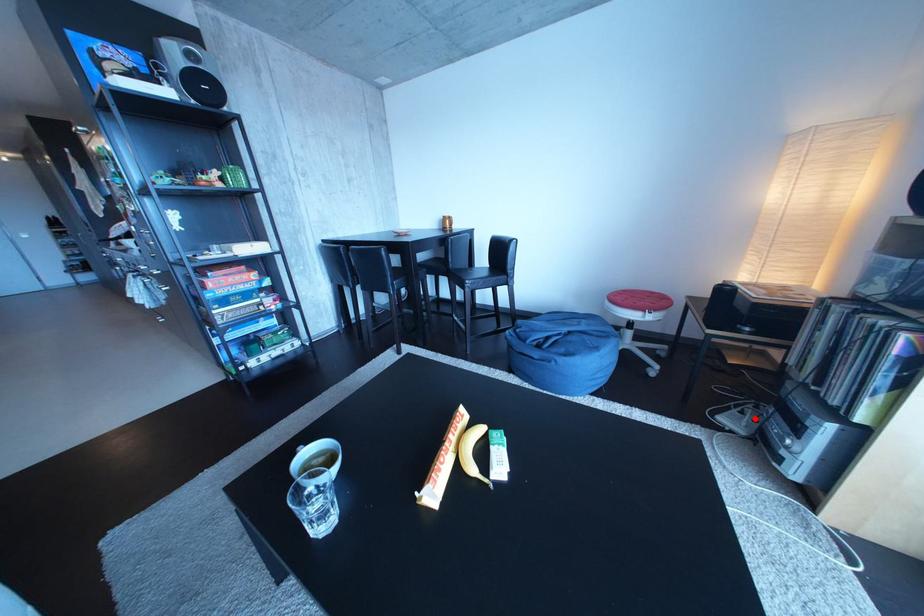
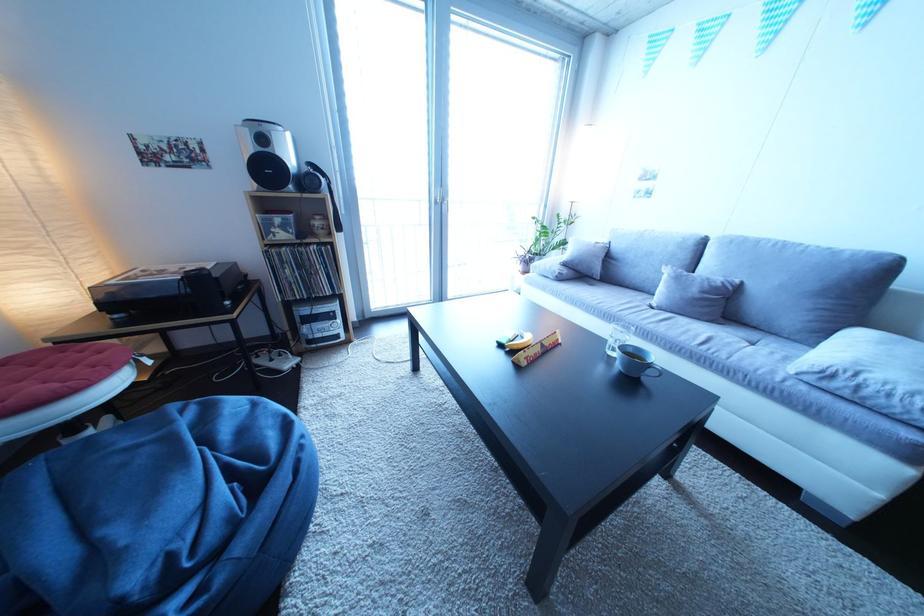
Locate, in the second image, the point that corresponds to the highlighted location in the first image.

(285, 366)